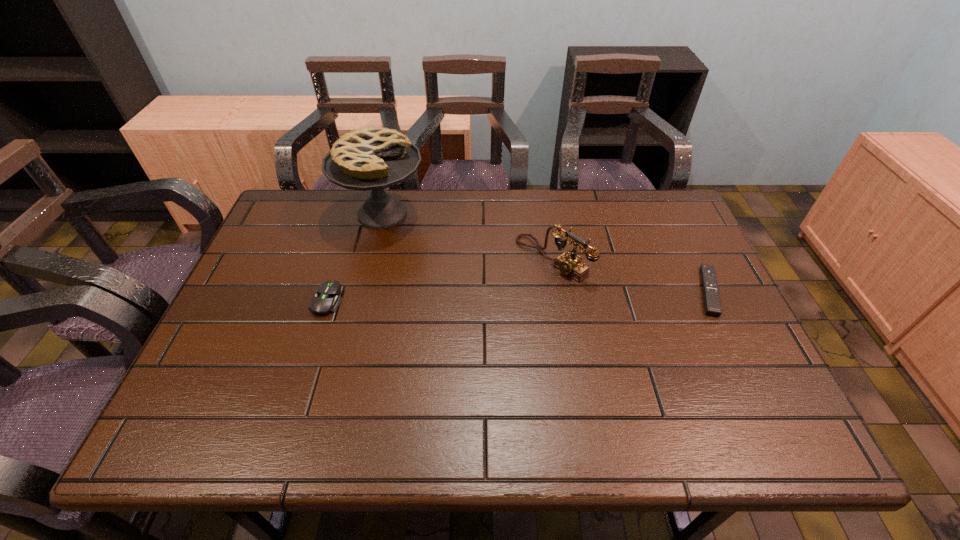
This screenshot has height=540, width=960. Identify the location of the second shortest object. (x=327, y=299).

Find the location of a particular element. The width and height of the screenshot is (960, 540). the shortest object is located at coordinates (712, 304).

Locate an element on the screen. remote control is located at coordinates (712, 304).

The width and height of the screenshot is (960, 540). Find the location of `the second object from right to left`. the second object from right to left is located at coordinates (569, 264).

This screenshot has width=960, height=540. In order to click on telephone in this screenshot , I will do `click(569, 264)`.

This screenshot has height=540, width=960. I want to click on the tallest object, so click(373, 158).

Image resolution: width=960 pixels, height=540 pixels. Identify the location of free space located on the right of the computer mouse. (440, 300).

Find the location of `free spot located on the front of the remote control`. free spot located on the front of the remote control is located at coordinates (748, 369).

You are a GUI agent. You are given a task and a screenshot of the screen. Output one action in this format:
    pyautogui.click(x=<x>, y=<y>)
    Task: Click on the free space located on the front-facing side of the second object from right to left
    
    Given the screenshot: What is the action you would take?
    pyautogui.click(x=429, y=347)

Identify the location of blank area located on the front-facing side of the second object from right to left. Image resolution: width=960 pixels, height=540 pixels. (422, 352).